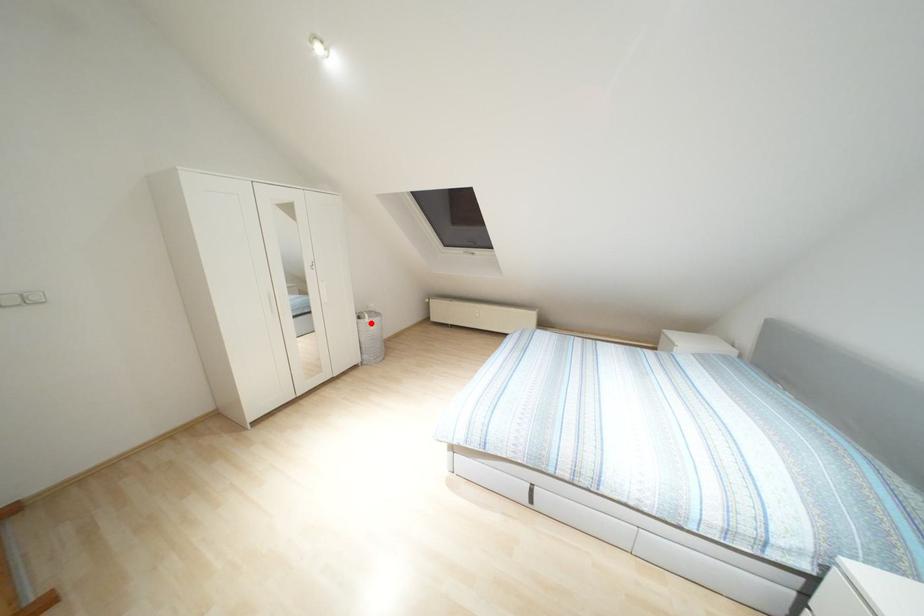
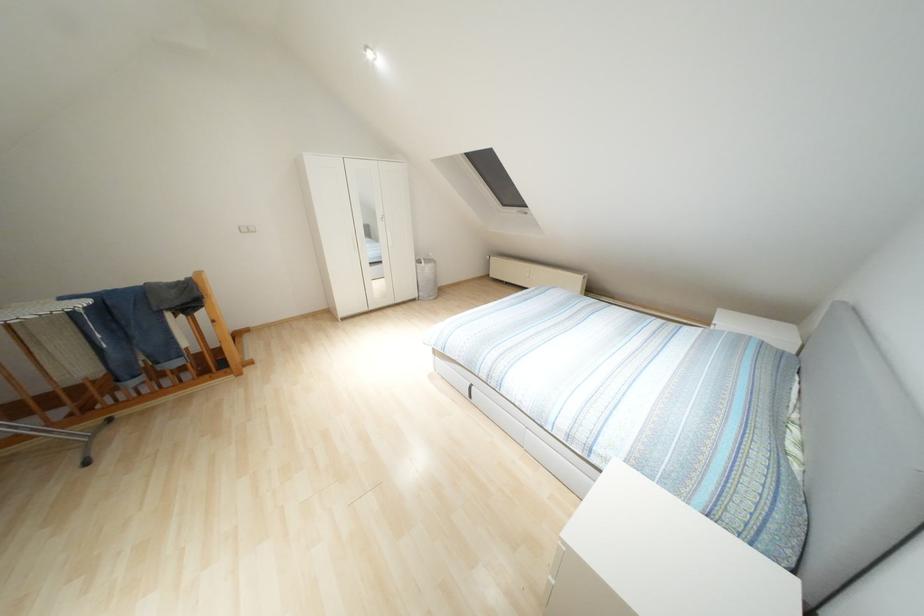
Question: I am providing you with two images of the same scene from different viewpoints. In image1, a red point is highlighted. Considering the same 3D point in image2, which of the following is correct?

Choices:
 (A) It is closer
 (B) It is farther

Answer: (A)